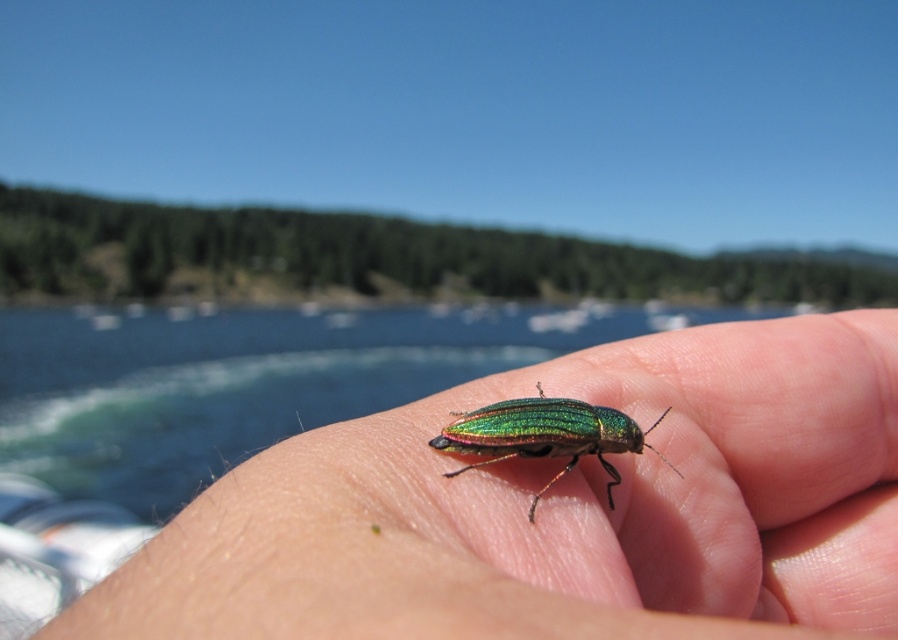
You are a photographer trying to capture the metallic green beetle at center and the metallic iridescent beetle at center in a single frame. Which beetle should you focus on to ensure both are in focus given the shallow depth of field?

The metallic green beetle at center is much taller than the metallic iridescent beetle at center, so focusing on the taller beetle will help keep both in focus as they are positioned at different heights.

You are a photographer trying to capture both the metallic green beetle at center and the metallic iridescent beetle at center in a single frame. Given that your camera has a focus range of 3 inches, can you adjust your position so that both beetles are in focus?

The metallic green beetle at center is 2.88 inches from the metallic iridescent beetle at center. Since the distance between them is less than the camera focus range of 3 inches, you can adjust your position to ensure both beetles are within the focus range and captured clearly in the frame.

You are a biologist observing the metallic green beetle at center and the metallic iridescent beetle at center. Which beetle has a wider body?

The metallic green beetle at center has a wider body than the metallic iridescent beetle at center.